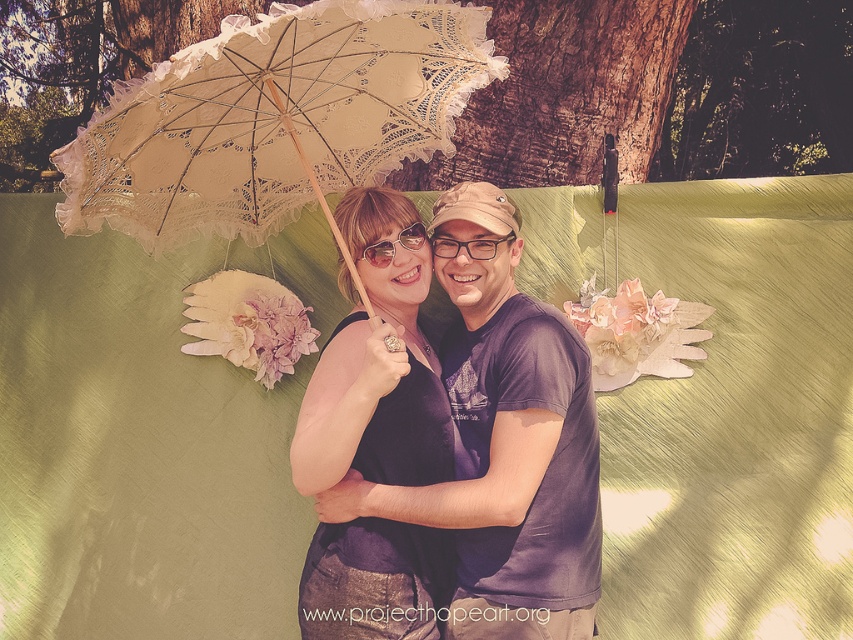
Is lace-covered beige umbrella at center shorter than matte black goggles at center?

In fact, lace-covered beige umbrella at center may be taller than matte black goggles at center.

Which is behind, point (468, 93) or point (381, 260)?

The point (468, 93) is behind.

What do you see at coordinates (274, 118) in the screenshot? I see `lace-covered beige umbrella at center` at bounding box center [274, 118].

The width and height of the screenshot is (853, 640). What are the coordinates of `lace-covered beige umbrella at center` in the screenshot? It's located at pyautogui.click(x=274, y=118).

Can you confirm if lace-covered beige umbrella at center is positioned below matte black dress at center?

No, lace-covered beige umbrella at center is not below matte black dress at center.

Which is in front, point (135, 140) or point (390, 612)?

Point (135, 140) is in front.

Image resolution: width=853 pixels, height=640 pixels. Find the location of `lace-covered beige umbrella at center`. lace-covered beige umbrella at center is located at coordinates (274, 118).

Which is below, purple cotton t-shirt at center or matte black goggles at center?

purple cotton t-shirt at center

The image size is (853, 640). What are the coordinates of `purple cotton t-shirt at center` in the screenshot? It's located at (515, 438).